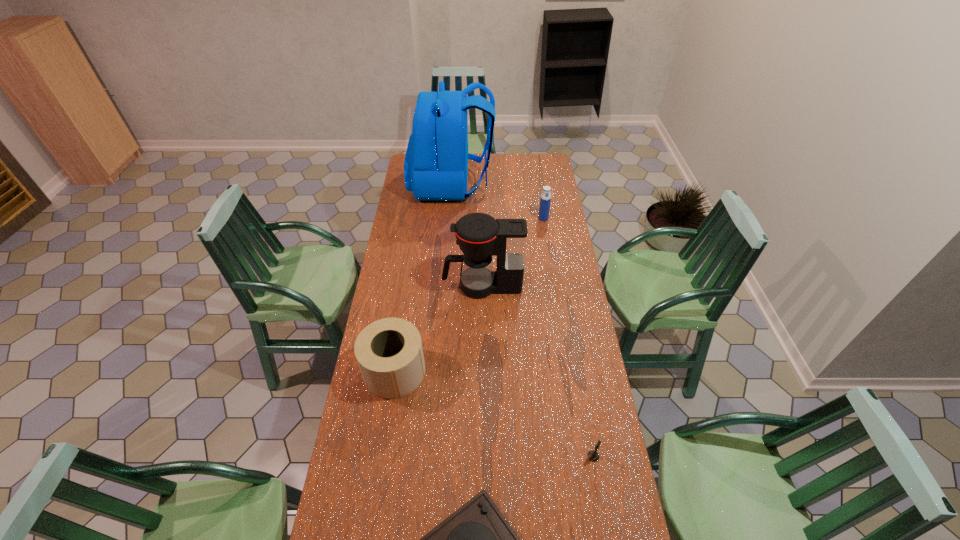
Locate an element on the screen. object at the far left corner is located at coordinates (436, 162).

Identify the location of blank space at the left edge of the desktop. This screenshot has height=540, width=960. (421, 231).

The image size is (960, 540). Identify the location of free location at the right edge. (552, 234).

In the image, there is a desktop. Identify the location of vacant region at the far right corner. This screenshot has width=960, height=540. (540, 169).

Find the location of a particular element. The height and width of the screenshot is (540, 960). free space between the toilet tissue and the tallest object is located at coordinates (423, 278).

Find the location of a particular element. The image size is (960, 540). unoccupied area between the candle and the toilet tissue is located at coordinates (494, 414).

Locate an element on the screen. free space that is in between the water bottle and the backpack is located at coordinates (497, 201).

The image size is (960, 540). Identify the location of vacant area that lies between the third farthest object and the toilet tissue. (439, 328).

Find the location of `object identified as the fourth closest to the second nearest object`. object identified as the fourth closest to the second nearest object is located at coordinates (545, 200).

Find the location of a particular element. The image size is (960, 540). object that ranks as the closest to the coffee maker is located at coordinates (389, 352).